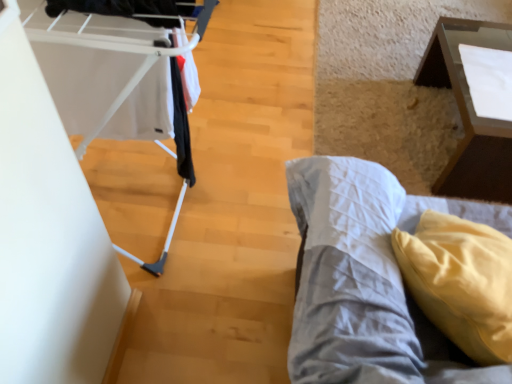
Question: Considering the relative positions of white plastic baby carriage at left and yellow fabric pillow at lower right in the image provided, is white plastic baby carriage at left behind yellow fabric pillow at lower right?

Choices:
 (A) no
 (B) yes

Answer: (B)

Question: Considering the relative sizes of white plastic baby carriage at left and yellow fabric pillow at lower right in the image provided, is white plastic baby carriage at left shorter than yellow fabric pillow at lower right?

Choices:
 (A) no
 (B) yes

Answer: (A)

Question: From the image's perspective, does white plastic baby carriage at left appear lower than yellow fabric pillow at lower right?

Choices:
 (A) no
 (B) yes

Answer: (A)

Question: Does white plastic baby carriage at left have a greater width compared to yellow fabric pillow at lower right?

Choices:
 (A) yes
 (B) no

Answer: (B)

Question: Is white plastic baby carriage at left not inside yellow fabric pillow at lower right?

Choices:
 (A) yes
 (B) no

Answer: (A)

Question: Looking at the image, does transparent glass table at upper right seem bigger or smaller compared to white plastic baby carriage at left?

Choices:
 (A) small
 (B) big

Answer: (B)

Question: From a real-world perspective, is transparent glass table at upper right positioned above or below white plastic baby carriage at left?

Choices:
 (A) above
 (B) below

Answer: (B)

Question: Considering their positions, is transparent glass table at upper right located in front of or behind white plastic baby carriage at left?

Choices:
 (A) behind
 (B) front

Answer: (A)

Question: Does point (471, 147) appear closer or farther from the camera than point (44, 16)?

Choices:
 (A) farther
 (B) closer

Answer: (A)

Question: Is transparent glass table at upper right inside or outside of yellow fabric pillow at lower right?

Choices:
 (A) outside
 (B) inside

Answer: (A)

Question: Is transparent glass table at upper right wider or thinner than yellow fabric pillow at lower right?

Choices:
 (A) wide
 (B) thin

Answer: (A)

Question: Considering the positions of transparent glass table at upper right and yellow fabric pillow at lower right in the image, is transparent glass table at upper right taller or shorter than yellow fabric pillow at lower right?

Choices:
 (A) short
 (B) tall

Answer: (A)

Question: From a real-world perspective, is transparent glass table at upper right above or below yellow fabric pillow at lower right?

Choices:
 (A) below
 (B) above

Answer: (A)

Question: From a real-world perspective, is yellow fabric pillow at lower right positioned above or below white plastic baby carriage at left?

Choices:
 (A) below
 (B) above

Answer: (A)

Question: From the image's perspective, relative to white plastic baby carriage at left, is yellow fabric pillow at lower right above or below?

Choices:
 (A) below
 (B) above

Answer: (A)